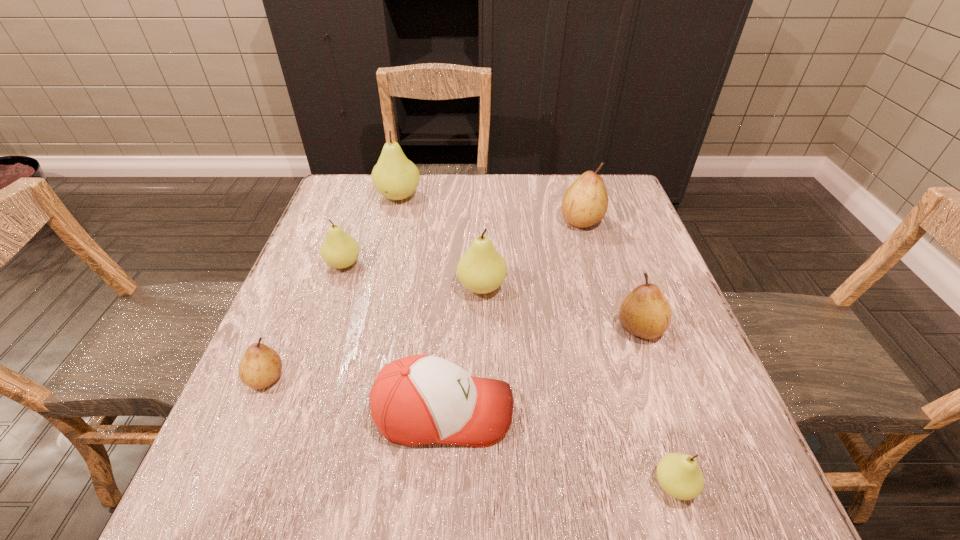
You are a GUI agent. You are given a task and a screenshot of the screen. Output one action in this format:
    pyautogui.click(x=<x>, y=<y>)
    Task: Click on the vacant space at the far right corner of the desktop
    The width and height of the screenshot is (960, 540).
    Given the screenshot: What is the action you would take?
    pyautogui.click(x=608, y=180)

The height and width of the screenshot is (540, 960). In order to click on vacant area between the third green pear from left to right and the third biggest green pear in this screenshot , I will do `click(413, 275)`.

I want to click on free space between the fifth farthest object and the third biggest green pear, so click(492, 296).

The height and width of the screenshot is (540, 960). I want to click on vacant space in between the third green pear from left to right and the third nearest pear, so click(x=561, y=307).

Where is `free area in between the fourth pear from left to right and the sixth farthest pear`? Image resolution: width=960 pixels, height=540 pixels. free area in between the fourth pear from left to right and the sixth farthest pear is located at coordinates (374, 332).

Find the location of a particular element. Image resolution: width=960 pixels, height=540 pixels. blank region between the second smallest green pear and the fourth pear from right to left is located at coordinates (413, 275).

Where is `free area in between the fifth farthest object and the third green pear from left to right`? The height and width of the screenshot is (540, 960). free area in between the fifth farthest object and the third green pear from left to right is located at coordinates (561, 307).

The image size is (960, 540). Find the location of `vacant space that's between the tallest object and the second nearest brown pear`. vacant space that's between the tallest object and the second nearest brown pear is located at coordinates (519, 262).

Identify the location of empty location between the fifth farthest object and the biggest brown pear. The image size is (960, 540). (611, 274).

At what (x,y) coordinates should I click in order to perform the action: click on free space between the biggest brown pear and the fourth nearest object. Please return your answer as a coordinate pair (x, y). Looking at the image, I should click on (611, 274).